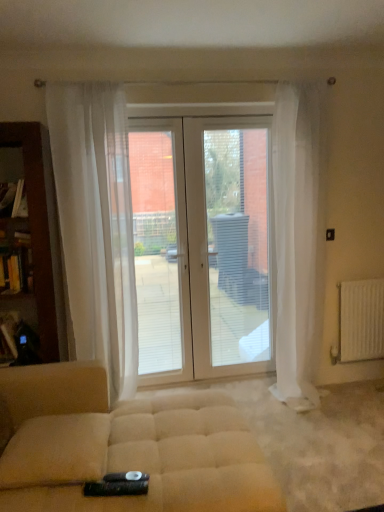
Identify the location of free spot below white metallic radiator at right (from a real-world perspective). The image size is (384, 512). click(x=355, y=384).